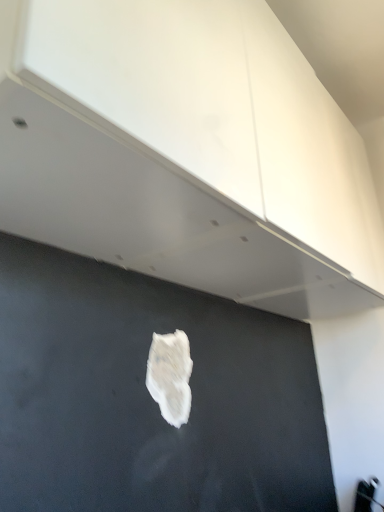
Identify the location of white matte paper at center. (170, 376).

Describe the element at coordinates (170, 376) in the screenshot. I see `white matte paper at center` at that location.

Locate an element on the screen. This screenshot has width=384, height=512. white glossy cabinet at upper center is located at coordinates (189, 154).

What do you see at coordinates (189, 154) in the screenshot?
I see `white glossy cabinet at upper center` at bounding box center [189, 154].

You are a GUI agent. You are given a task and a screenshot of the screen. Output one action in this format:
    pyautogui.click(x=<x>, y=<y>)
    Task: Click on the white matte paper at center
    The width and height of the screenshot is (384, 512).
    Given the screenshot: What is the action you would take?
    pyautogui.click(x=170, y=376)

Is white glossy cabinet at upper center at the left side of white matte paper at center?

In fact, white glossy cabinet at upper center is to the right of white matte paper at center.

Is white glossy cabinet at upper center positioned in front of white matte paper at center?

Yes, white glossy cabinet at upper center is closer to the viewer.

Between point (80, 245) and point (172, 356), which one is positioned behind?

The point (172, 356) is behind.

From the image's perspective, which is above, white glossy cabinet at upper center or white matte paper at center?

white glossy cabinet at upper center appears higher in the image.

From a real-world perspective, is white glossy cabinet at upper center located beneath white matte paper at center?

Incorrect, from a real-world perspective, white glossy cabinet at upper center is higher than white matte paper at center.

Which of these two, white glossy cabinet at upper center or white matte paper at center, is wider?

Wider between the two is white glossy cabinet at upper center.

Who is shorter, white glossy cabinet at upper center or white matte paper at center?

white matte paper at center is shorter.

Consider the image. Is white glossy cabinet at upper center smaller than white matte paper at center?

No.

Is white glossy cabinet at upper center spatially inside white matte paper at center, or outside of it?

white glossy cabinet at upper center is not enclosed by white matte paper at center.

Is the surface of white glossy cabinet at upper center in direct contact with white matte paper at center?

No.

Is white glossy cabinet at upper center facing away from white matte paper at center?

No, white glossy cabinet at upper center's orientation is not away from white matte paper at center.

What's the angular difference between white glossy cabinet at upper center and white matte paper at center's facing directions?

They differ by 0.489 degrees in their facing directions.

Measure the distance between white glossy cabinet at upper center and white matte paper at center.

44.93 centimeters.

In the image, there is a white glossy cabinet at upper center. At what (x,y) coordinates should I click in order to perform the action: click on patch below it (from the image's perspective). Please return your answer as a coordinate pair (x, y). Image resolution: width=384 pixels, height=512 pixels. Looking at the image, I should click on (170, 376).

Based on their positions, is white matte paper at center located to the left or right of white glossy cabinet at upper center?

white matte paper at center is to the left of white glossy cabinet at upper center.

Considering the positions of objects white matte paper at center and white glossy cabinet at upper center in the image provided, who is behind, white matte paper at center or white glossy cabinet at upper center?

white matte paper at center.

Is point (171, 353) closer to viewer compared to point (272, 275)?

Yes, point (171, 353) is closer to viewer.

From the image's perspective, is white matte paper at center located above or below white glossy cabinet at upper center?

Based on their image positions, white matte paper at center is located beneath white glossy cabinet at upper center.

From a real-world perspective, is white matte paper at center beneath white glossy cabinet at upper center?

Yes, from a real-world perspective, white matte paper at center is beneath white glossy cabinet at upper center.

Between white matte paper at center and white glossy cabinet at upper center, which one has larger width?

With larger width is white glossy cabinet at upper center.

Is white matte paper at center shorter than white glossy cabinet at upper center?

Yes.

Who is bigger, white matte paper at center or white glossy cabinet at upper center?

Bigger between the two is white glossy cabinet at upper center.

Choose the correct answer: Is white matte paper at center inside white glossy cabinet at upper center or outside it?

white matte paper at center is not inside white glossy cabinet at upper center, it's outside.

Is white matte paper at center directly adjacent to white glossy cabinet at upper center?

No, white matte paper at center is not next to white glossy cabinet at upper center.

Is white matte paper at center positioned with its back to white glossy cabinet at upper center?

white matte paper at center is not turned away from white glossy cabinet at upper center.

How different are the orientations of white matte paper at center and white glossy cabinet at upper center in degrees?

0.489 degrees separate the facing orientations of white matte paper at center and white glossy cabinet at upper center.

How far apart are white matte paper at center and white glossy cabinet at upper center?

white matte paper at center is 17.69 inches from white glossy cabinet at upper center.

Locate an element on the screen. Image resolution: width=384 pixels, height=512 pixels. cabinetry that appears above the white matte paper at center (from a real-world perspective) is located at coordinates (189, 154).

Where is `patch below the white glossy cabinet at upper center (from the image's perspective)`? The image size is (384, 512). patch below the white glossy cabinet at upper center (from the image's perspective) is located at coordinates (170, 376).

Find the location of a particular element. This screenshot has width=384, height=512. patch below the white glossy cabinet at upper center (from a real-world perspective) is located at coordinates (170, 376).